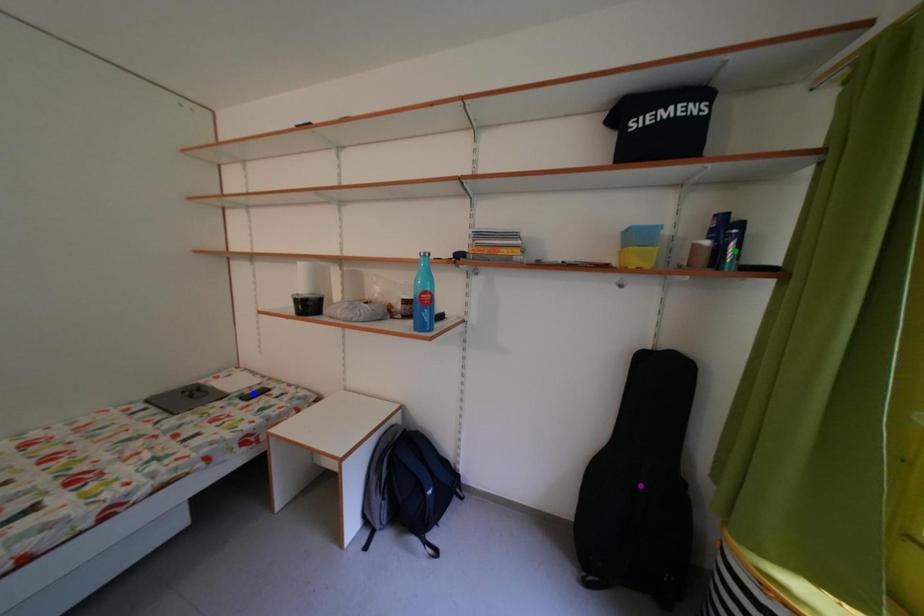
Order these from nearest to farthest:
green point | purple point | blue point

green point, purple point, blue point